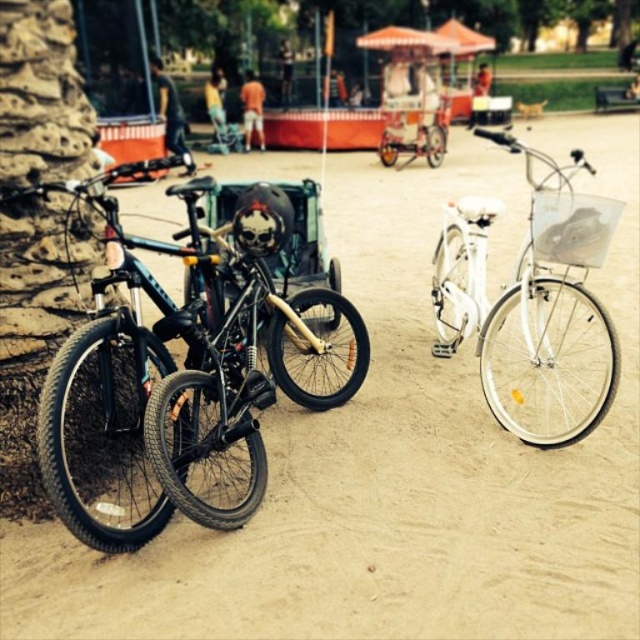
You are standing in the park and want to take a photo of the shiny black bicycle at left and the white metallic bicycle at right. If you look down from your current position, which bicycle would appear lower in the photo?

The shiny black bicycle at left appears lower in the photo because it is positioned below the white metallic bicycle at right according to their spatial arrangement.

You are a painter standing between the shiny black bicycle at left and the white metallic bicycle at right. You want to paint the taller bicycle first. Which bicycle should you choose?

The shiny black bicycle at left is taller than the white metallic bicycle at right, so you should paint the shiny black bicycle at left first.